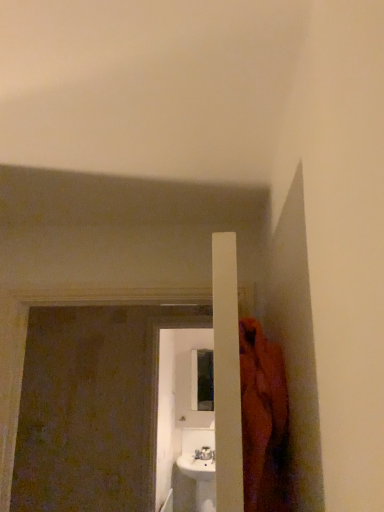
Question: Is white glossy screen door at center, placed as the 2th screen door when sorted from front to back, situated inside brown textured screen door at left, the 2th screen door from the back, or outside?

Choices:
 (A) inside
 (B) outside

Answer: (B)

Question: Is point (157, 457) closer or farther from the camera than point (21, 434)?

Choices:
 (A) closer
 (B) farther

Answer: (B)

Question: Considering the positions of white glossy screen door at center, placed as the 2th screen door when sorted from front to back, and brown textured screen door at left, the first screen door when ordered from front to back, in the image, is white glossy screen door at center, placed as the 2th screen door when sorted from front to back, wider or thinner than brown textured screen door at left, the first screen door when ordered from front to back,?

Choices:
 (A) wide
 (B) thin

Answer: (B)

Question: In terms of width, does brown textured screen door at left, the 2th screen door from the back, look wider or thinner when compared to white glossy screen door at center, placed as the 2th screen door when sorted from front to back?

Choices:
 (A) wide
 (B) thin

Answer: (A)

Question: In terms of height, does brown textured screen door at left, the first screen door when ordered from front to back, look taller or shorter compared to white glossy screen door at center, positioned as the first screen door in back-to-front order?

Choices:
 (A) short
 (B) tall

Answer: (A)

Question: Relative to white glossy screen door at center, positioned as the first screen door in back-to-front order, is brown textured screen door at left, the first screen door when ordered from front to back, in front or behind?

Choices:
 (A) behind
 (B) front

Answer: (B)

Question: From a real-world perspective, relative to white glossy screen door at center, positioned as the first screen door in back-to-front order, is brown textured screen door at left, the first screen door when ordered from front to back, vertically above or below?

Choices:
 (A) below
 (B) above

Answer: (B)